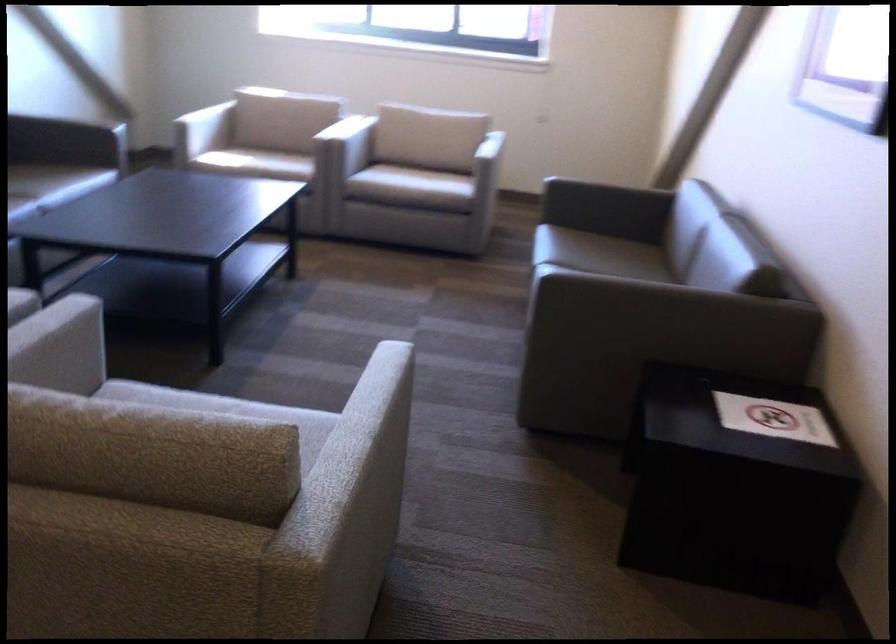
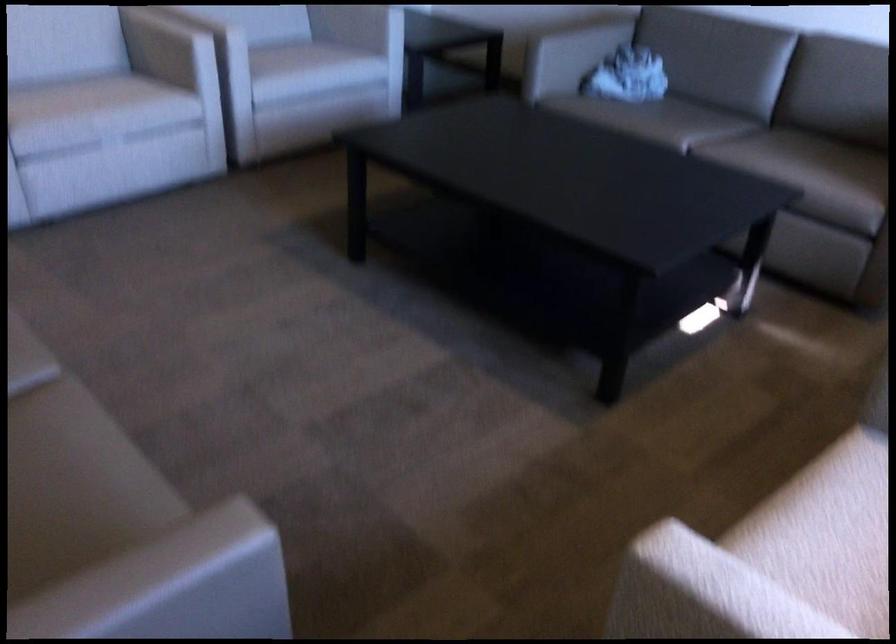
The point at [390,176] is marked in the first image. Where is the corresponding point in the second image?

(830, 509)